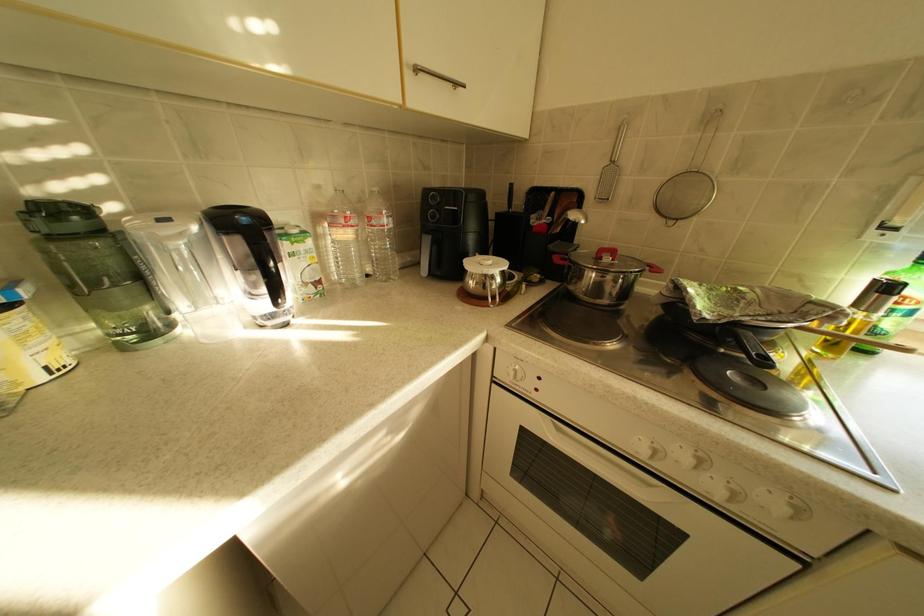
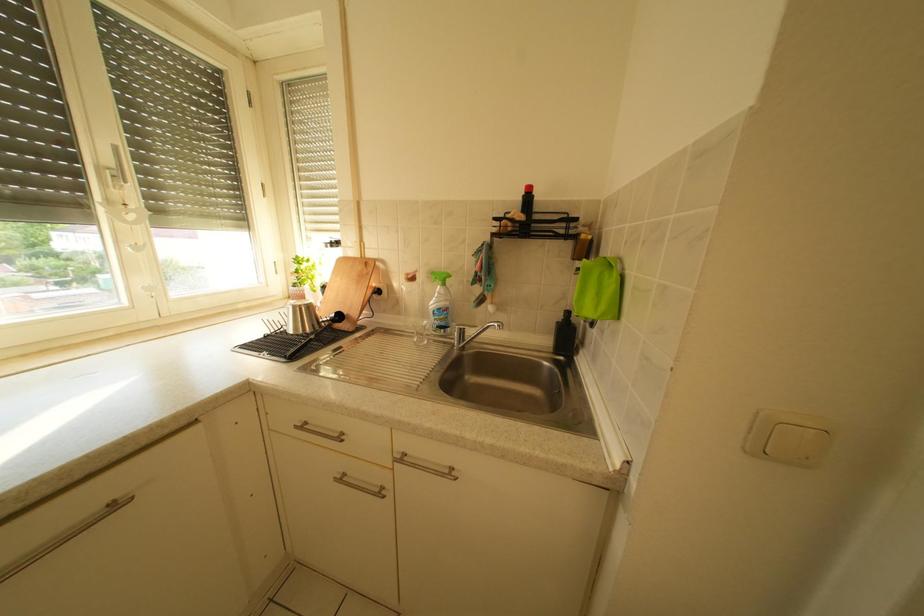
The first image is from the beginning of the video and the second image is from the end. How did the camera likely rotate when shooting the video?

The camera rotated toward right-down.